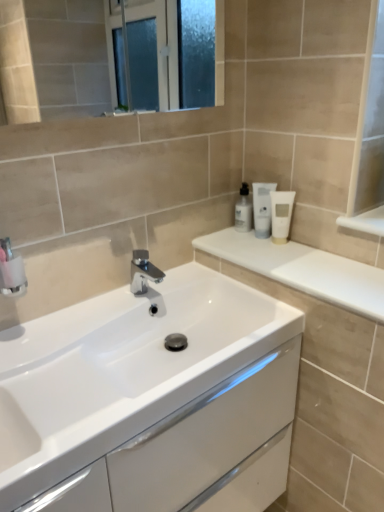
You are a GUI agent. You are given a task and a screenshot of the screen. Output one action in this format:
    pyautogui.click(x=<x>, y=<y>)
    Task: Click on the empty space that is ontop of white glossy countertop at upper right (from a real-world perspective)
    
    Given the screenshot: What is the action you would take?
    pyautogui.click(x=295, y=259)